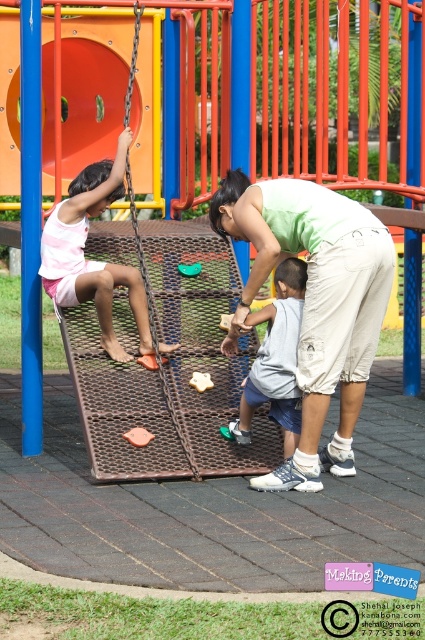
Question: Is green cotton shirt at center further to camera compared to rubberized plastic toy at center?

Choices:
 (A) no
 (B) yes

Answer: (A)

Question: Which point is farther to the camera?

Choices:
 (A) rubberized plastic toy at center
 (B) metallic yellow star at center

Answer: (B)

Question: Among these objects, which one is farthest from the camera?

Choices:
 (A) gray fabric shorts at center
 (B) pink fabric shorts at left
 (C) rubberized plastic toy at center

Answer: (B)

Question: Does pink fabric shorts at left appear over yellow matte star at center?

Choices:
 (A) no
 (B) yes

Answer: (B)

Question: Is yellow matte star at center wider than metallic yellow star at center?

Choices:
 (A) no
 (B) yes

Answer: (A)

Question: Which object is closer to the camera taking this photo?

Choices:
 (A) pink fabric shorts at left
 (B) gray fabric shorts at center
 (C) yellow matte star at center
 (D) metallic yellow star at center

Answer: (B)